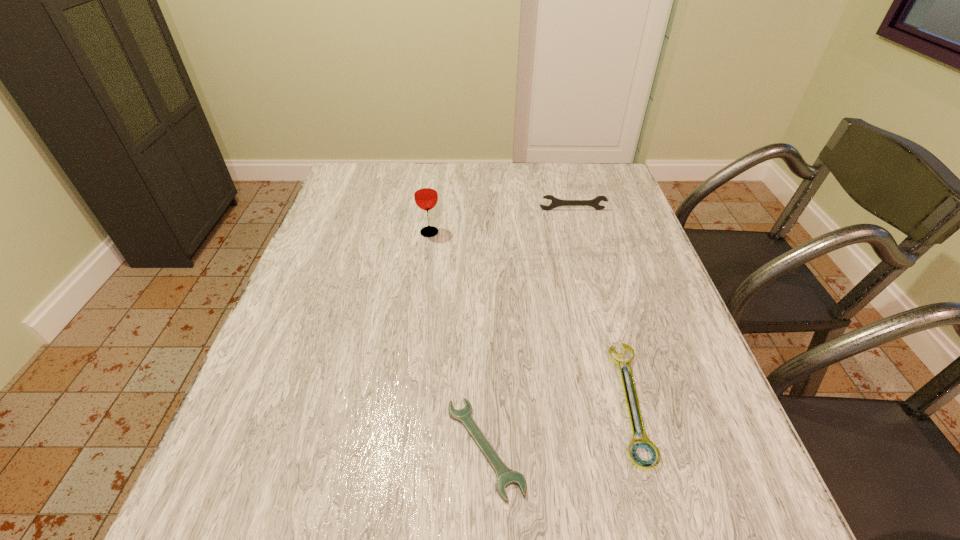
Where is `the tallest object`? The width and height of the screenshot is (960, 540). the tallest object is located at coordinates click(x=425, y=191).

You are a GUI agent. You are given a task and a screenshot of the screen. Output one action in this format:
    pyautogui.click(x=<x>, y=<y>)
    Task: Click on the third nearest object
    This screenshot has height=540, width=960.
    Given the screenshot: What is the action you would take?
    pyautogui.click(x=425, y=191)

Where is `the third shortest object`? Image resolution: width=960 pixels, height=540 pixels. the third shortest object is located at coordinates (555, 202).

Locate an element on the screen. the tallest wrench is located at coordinates [x=555, y=202].

What are the coordinates of `the second object from left to right` in the screenshot? It's located at (505, 476).

Locate an element on the screen. The height and width of the screenshot is (540, 960). free space located on the back of the second farthest object is located at coordinates (435, 195).

Locate an element on the screen. The width and height of the screenshot is (960, 540). free space located on the open ends of the third shortest object is located at coordinates (599, 309).

This screenshot has width=960, height=540. What are the coordinates of `blank area located on the back of the leftmost wrench` in the screenshot? It's located at (484, 315).

The height and width of the screenshot is (540, 960). Find the location of `object at the near edge`. object at the near edge is located at coordinates (505, 476).

Locate an element on the screen. vacant space at the far edge of the desktop is located at coordinates click(x=565, y=168).